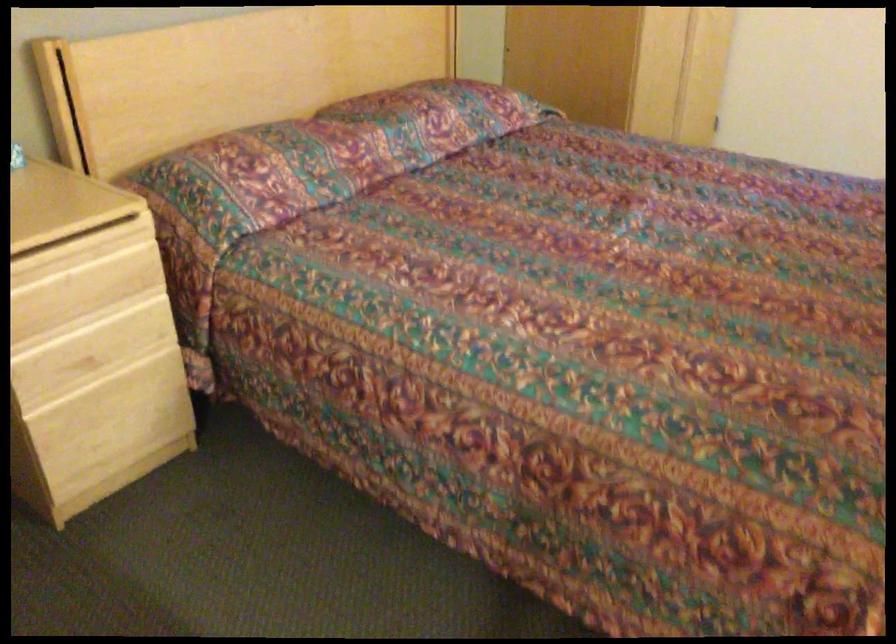
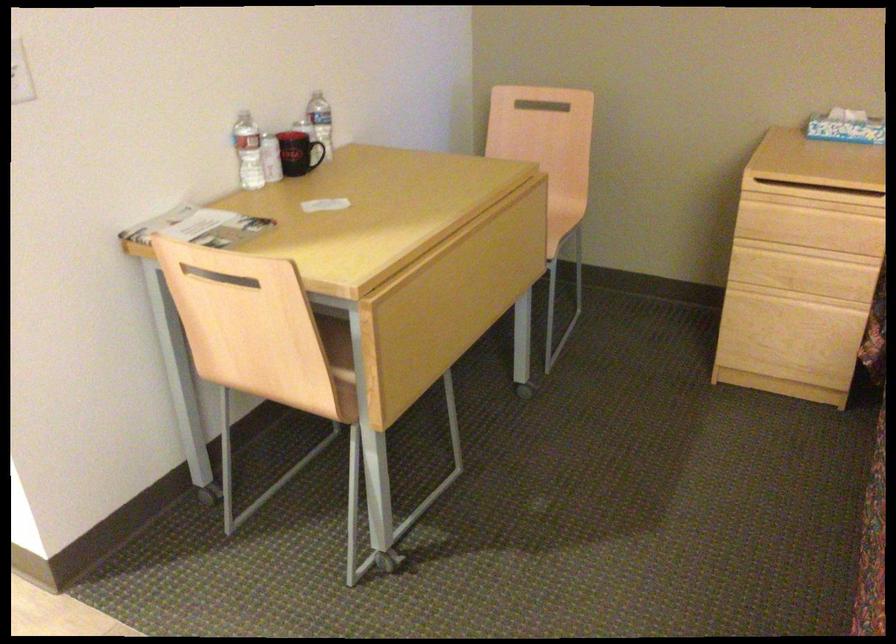
Locate, in the second image, the point that corresponds to (x=110, y=393) in the first image.

(790, 313)